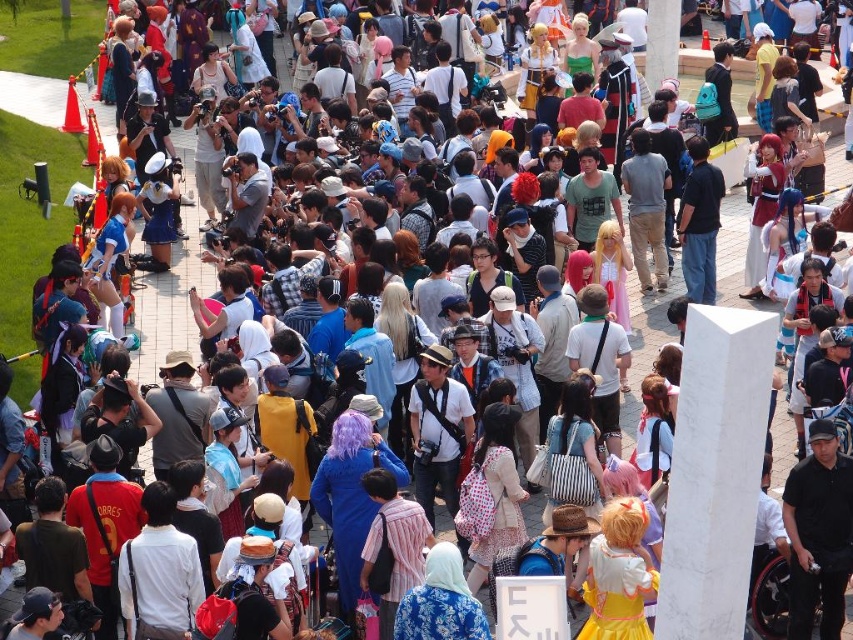
You are a photographer at the cosplay event. You need to take a photo of both the black cotton shirt at center and the dark blue shirt at center. Which one should you focus on first to ensure both are in the frame?

You should focus on the black cotton shirt at center first because it is much taller than the dark blue shirt at center, so positioning it properly will help ensure both fit within the frame.

You are a photographer at the event and want to take a photo of the dark blue shirt at center without the white marble pillar at center blocking it. How should you adjust your position?

The white marble pillar at center is below the dark blue shirt at center, so you can move your camera upwards to avoid the pillar and capture the dark blue shirt at center clearly.

You are a photographer at the event and want to capture a photo of the dark blue shirt at center without the white marble pillar at center blocking the view. Is it possible based on their heights?

The white marble pillar at center is shorter than the dark blue shirt at center, so the photographer can position themselves to ensure the dark blue shirt at center is visible above the pillar, avoiding obstruction.